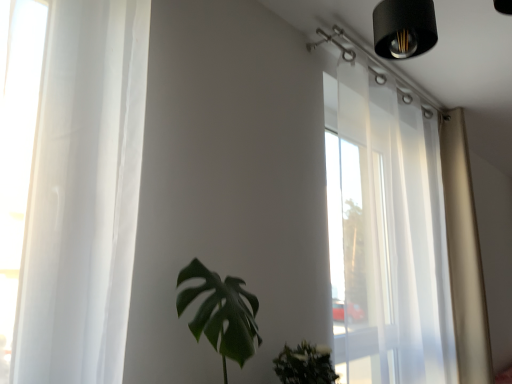
Question: Does green matte leafy plant at center have a lesser width compared to transparent curtain at upper right?

Choices:
 (A) yes
 (B) no

Answer: (B)

Question: Does green matte leafy plant at center have a lesser height compared to transparent curtain at upper right?

Choices:
 (A) no
 (B) yes

Answer: (B)

Question: Is the position of green matte leafy plant at center less distant than that of transparent curtain at upper right?

Choices:
 (A) no
 (B) yes

Answer: (B)

Question: Is green matte leafy plant at center oriented towards transparent curtain at upper right?

Choices:
 (A) yes
 (B) no

Answer: (B)

Question: Is green matte leafy plant at center smaller than transparent curtain at upper right?

Choices:
 (A) no
 (B) yes

Answer: (B)

Question: Based on their sizes in the image, would you say green matte leafy plant at center is bigger or smaller than transparent curtain at upper right?

Choices:
 (A) big
 (B) small

Answer: (B)

Question: Is point (217, 274) positioned closer to the camera than point (384, 150)?

Choices:
 (A) farther
 (B) closer

Answer: (B)

Question: In the image, is green matte leafy plant at center positioned in front of or behind transparent curtain at upper right?

Choices:
 (A) behind
 (B) front

Answer: (B)

Question: Considering the relative positions of green matte leafy plant at center and transparent curtain at upper right in the image provided, is green matte leafy plant at center to the left or to the right of transparent curtain at upper right?

Choices:
 (A) right
 (B) left

Answer: (B)

Question: Is point (237, 339) closer or farther from the camera than point (488, 344)?

Choices:
 (A) closer
 (B) farther

Answer: (A)

Question: Looking at their shapes, would you say green matte leafy plant at center is wider or thinner than beige fabric curtain at right?

Choices:
 (A) wide
 (B) thin

Answer: (A)

Question: From a real-world perspective, relative to beige fabric curtain at right, is green matte leafy plant at center vertically above or below?

Choices:
 (A) above
 (B) below

Answer: (B)

Question: From the image's perspective, relative to beige fabric curtain at right, is green matte leafy plant at center above or below?

Choices:
 (A) below
 (B) above

Answer: (A)

Question: In the image, is beige fabric curtain at right on the left side or the right side of green matte leafy plant at center?

Choices:
 (A) left
 (B) right

Answer: (B)

Question: Is beige fabric curtain at right situated inside green matte leafy plant at center or outside?

Choices:
 (A) inside
 (B) outside

Answer: (B)